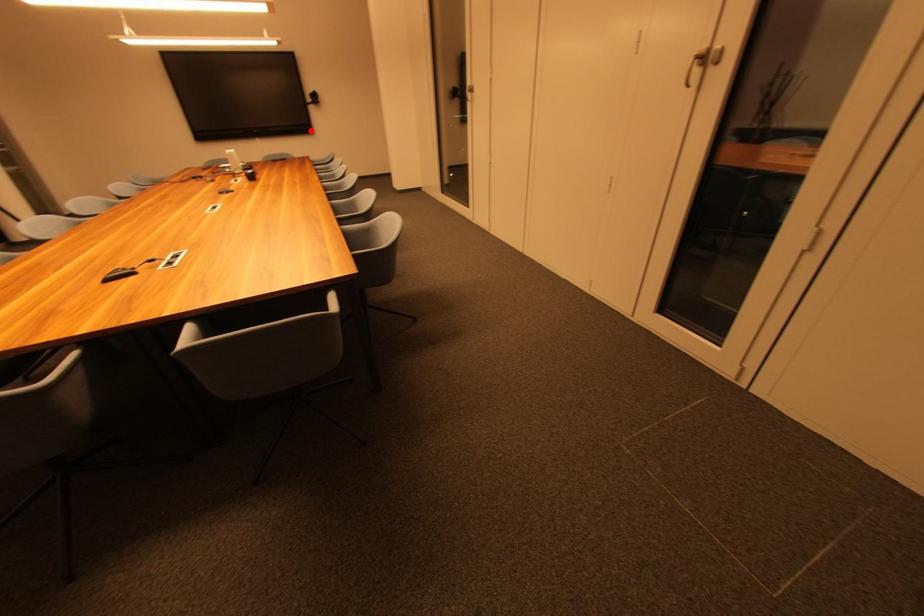
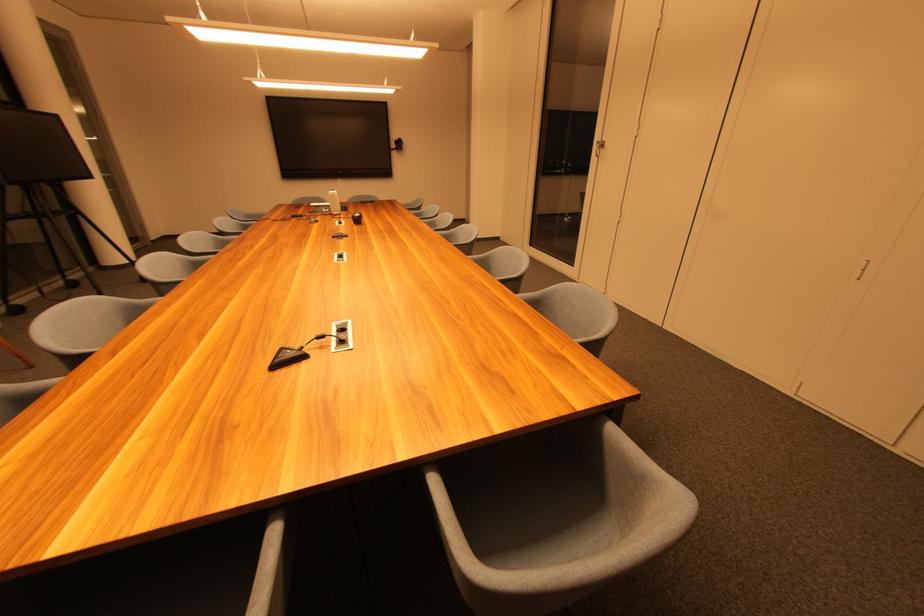
Find the pixel in the second image that matches the highlighted location in the first image.

(391, 175)